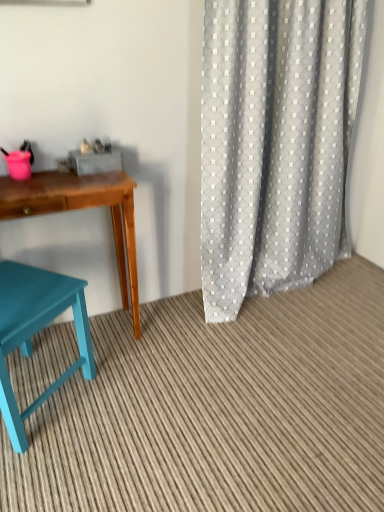
Find the location of a particular element. Image resolution: width=384 pixels, height=512 pixels. vacant space in front of gray textured curtain at right is located at coordinates (283, 365).